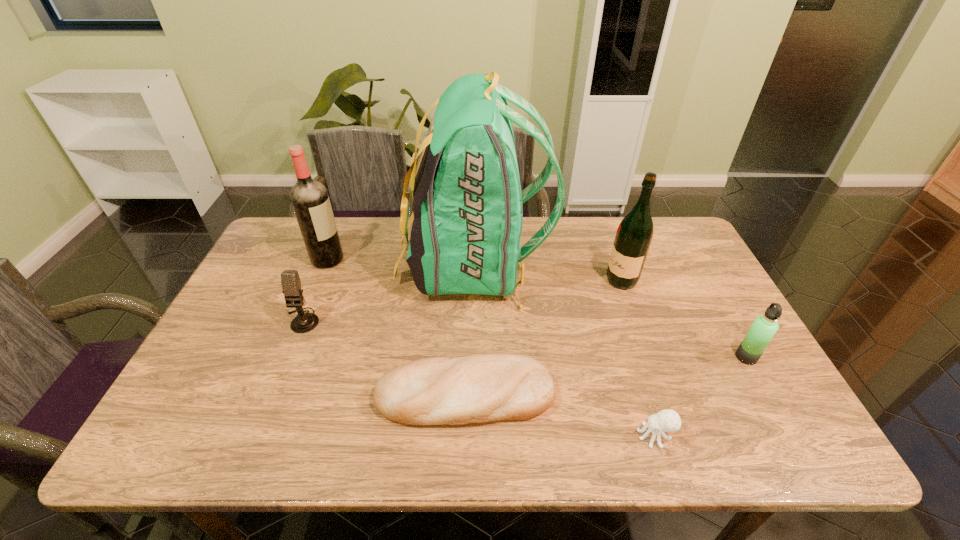
At what (x,y) coordinates should I click in order to perform the action: click on vacant area that lies between the microphone and the bread. Please return your answer as a coordinate pair (x, y). This screenshot has height=540, width=960. Looking at the image, I should click on (384, 358).

At what (x,y) coordinates should I click in order to perform the action: click on vacant space in between the microphone and the bread. Please return your answer as a coordinate pair (x, y). Looking at the image, I should click on (384, 358).

This screenshot has height=540, width=960. Identify the location of free space between the farther liquor and the backpack. (400, 262).

At what (x,y) coordinates should I click in order to perform the action: click on empty space that is in between the microphone and the left liquor. Please return your answer as a coordinate pair (x, y). This screenshot has height=540, width=960. Looking at the image, I should click on (315, 289).

Identify the location of unoccupied area between the left liquor and the bread. (396, 327).

Find the location of `free space between the rightmost object and the backpack`. free space between the rightmost object and the backpack is located at coordinates (610, 311).

The height and width of the screenshot is (540, 960). What are the coordinates of `vacant space that's between the tallest object and the octopus` in the screenshot? It's located at (564, 350).

This screenshot has height=540, width=960. Identify the location of free point between the farther liquor and the octopus. (492, 347).

Find the location of a particular element. This screenshot has width=960, height=540. object that is the third closest to the octopus is located at coordinates (467, 201).

Where is `object that ranks as the closest to the right liquor`? The image size is (960, 540). object that ranks as the closest to the right liquor is located at coordinates (467, 201).